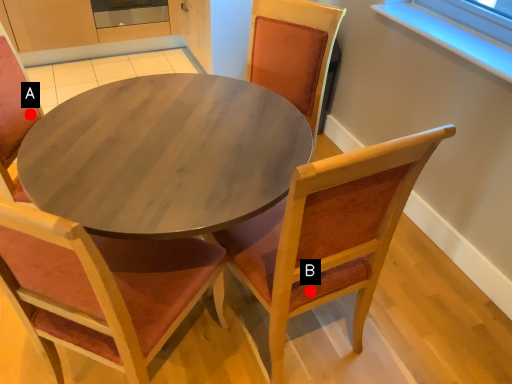
Question: Two points are circled on the image, labeled by A and B beside each circle. Among these points, which one is nearest to the camera?

Choices:
 (A) A is closer
 (B) B is closer

Answer: (B)